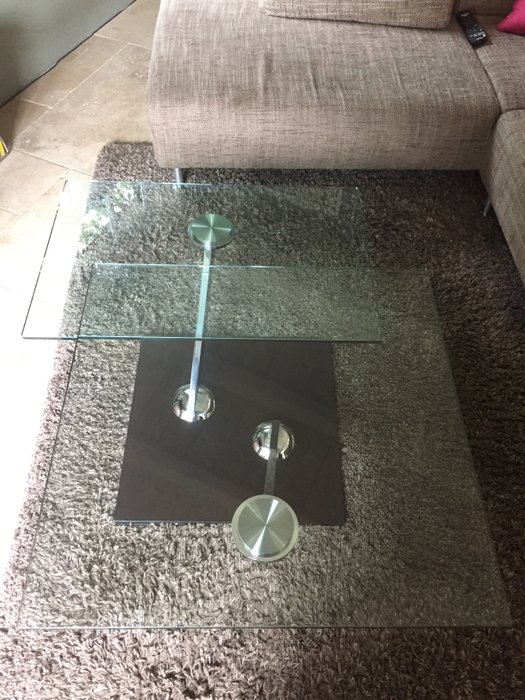
The width and height of the screenshot is (525, 700). I want to click on square brown table base, so click(206, 449).